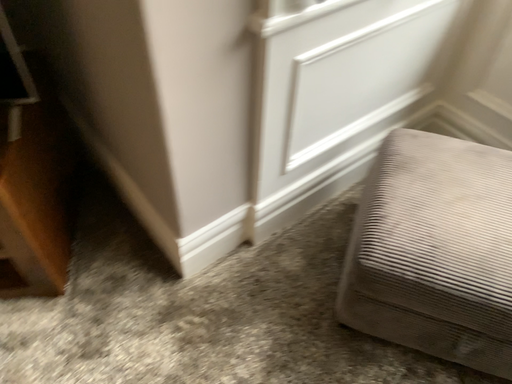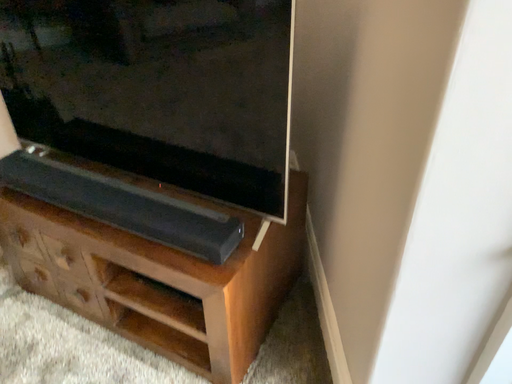
Question: Which way did the camera rotate in the video?

Choices:
 (A) rotated left
 (B) rotated right

Answer: (A)